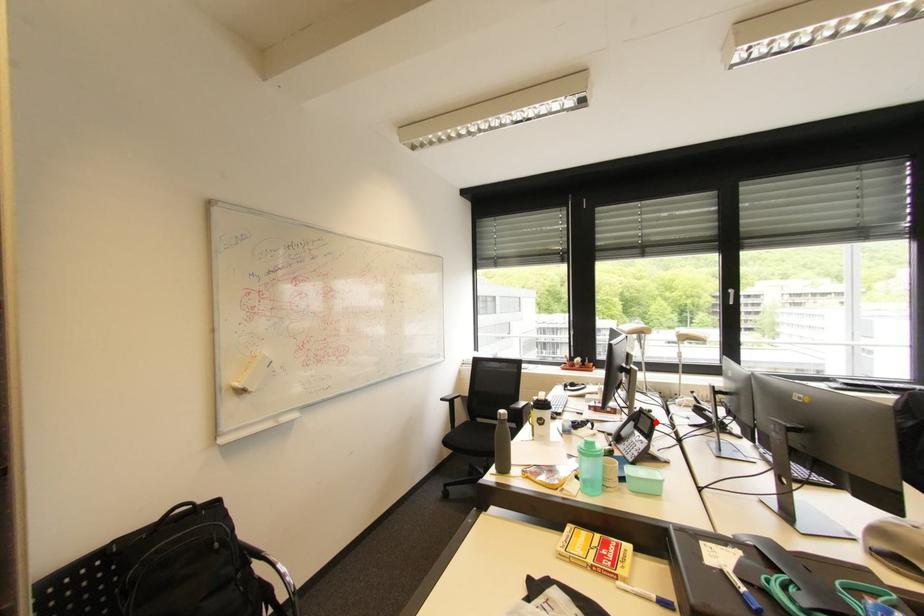
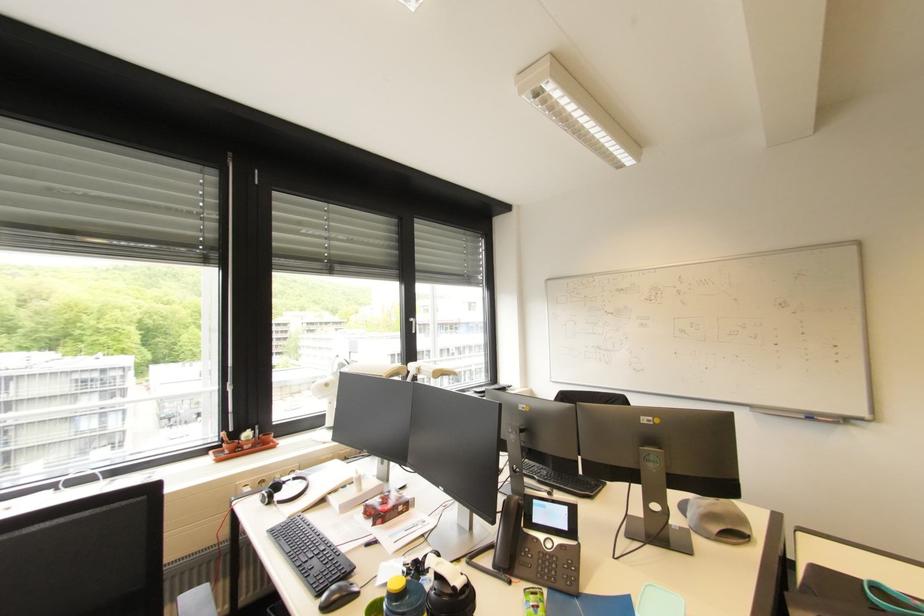
Question: I am providing you with two images of the same scene from different viewpoints. Given a red point in image1, look at the same physical point in image2. Is it:

Choices:
 (A) Closer to the viewpoint
 (B) Farther from the viewpoint

Answer: (A)